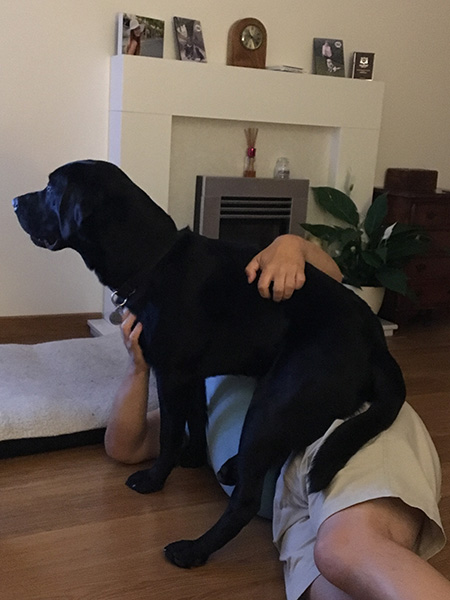
I want to click on flower pot, so click(378, 293).